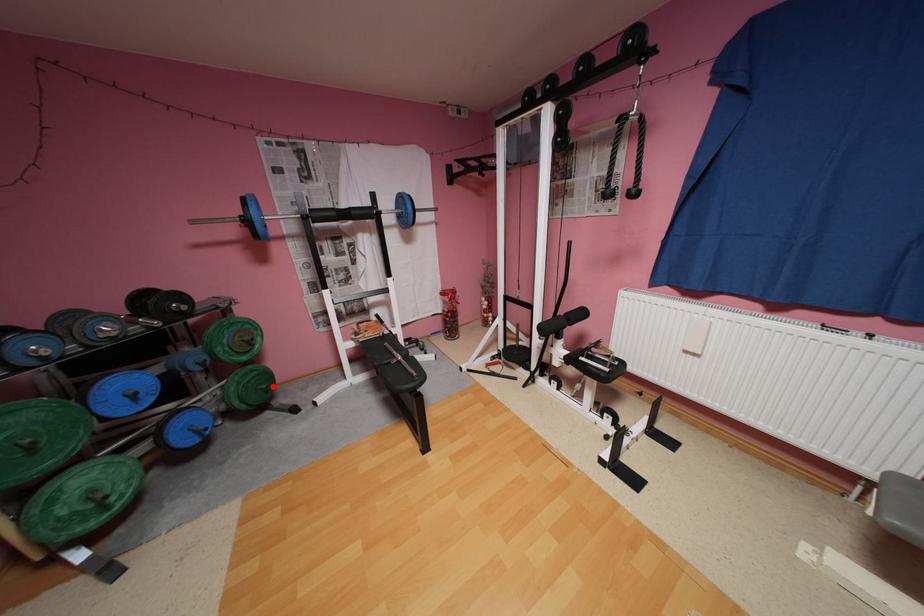
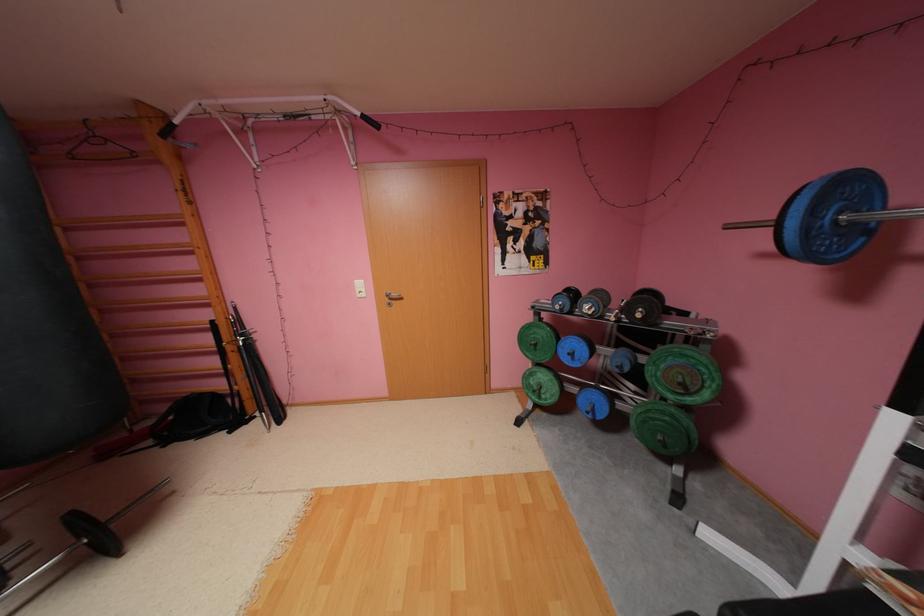
Locate, in the second image, the point that corresponds to the highlighted location in the first image.

(669, 438)